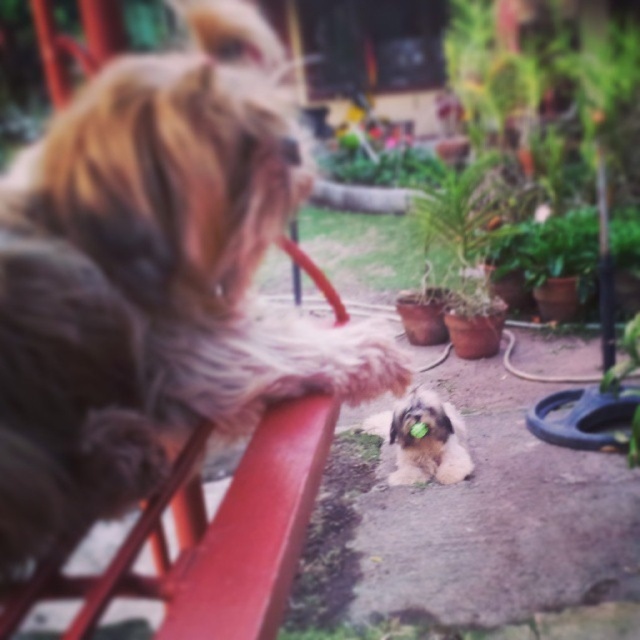
You are a gardener who wants to water the green leafy plant at lower right without getting the fluffy white dog at center wet. Can you reach the plant from your current position without moving the dog?

The fluffy white dog at center is 29.54 inches away from the green leafy plant at lower right. Since the distance is sufficient, you can water the plant without moving the dog as there is enough space between them.

You are standing in the garden and want to take a photo of the fluffy white dog at center and the green leafy plant at lower right. Which object is positioned to the left of the other?

The fluffy white dog at center is to the left of the green leafy plant at lower right.

You are standing in the garden and want to water the green leafy plant at center. Your watering can has a range of 6 meters. Can you reach the plant without moving closer?

The green leafy plant at center is 6.50 meters away from the viewer. Since the watering can only reaches 6 meters, you cannot water it without moving closer.